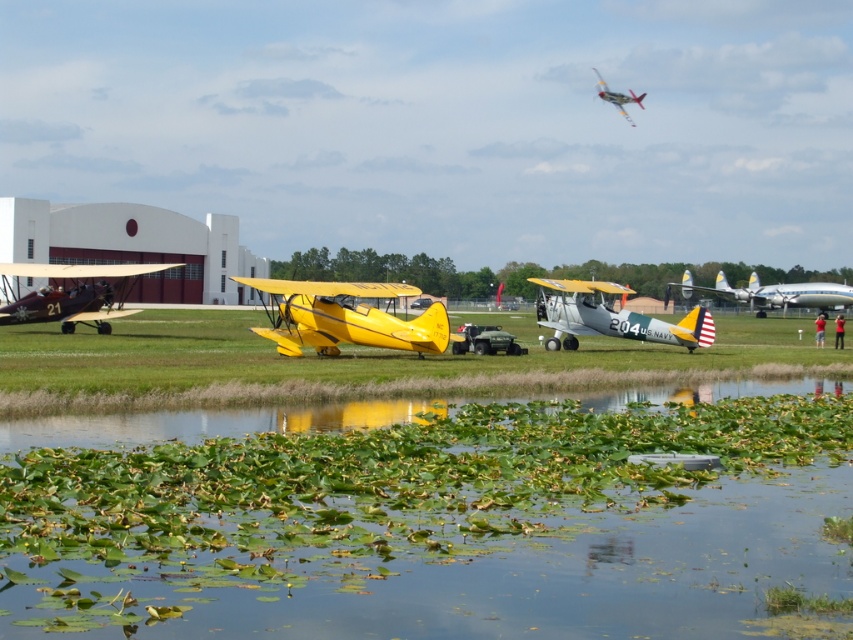
Based on the photo, you are a pilot planning to taxi your small aircraft between the yellow matte airplane at center and the silver metallic airplane at center right. Based on their widths, which airplane should you position your aircraft closer to to ensure enough space?

The yellow matte airplane at center has a lesser width compared to the silver metallic airplane at center right, so positioning your aircraft closer to the yellow matte airplane at center would provide more space.

In the scene shown: You are standing at the water edge in the aviation scene. You see two points marked on the ground. The first point is at position point (183,426) and the second point is at point (44,310). If you walk towards the second point, will you pass by the first point before reaching it?

Yes, because point (183,426) is in front of point (44,310), so walking towards the second point would require passing the first point first.

You are a pilot standing near the matte yellow biplane at left and want to walk to the green leafy water at lower center. Which direction should you head?

The green leafy water at lower center is to the right of the matte yellow biplane at left, so you should head to the right to reach it.